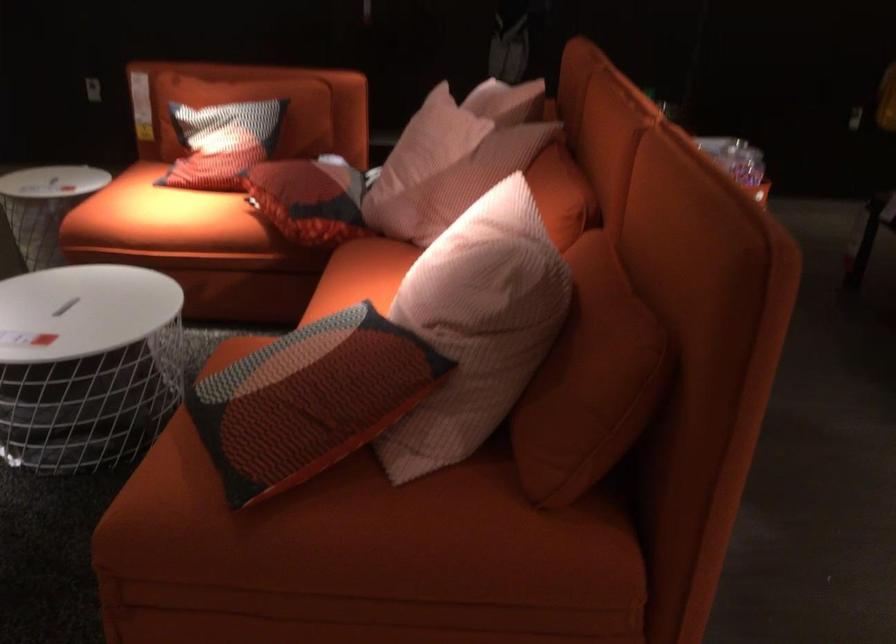
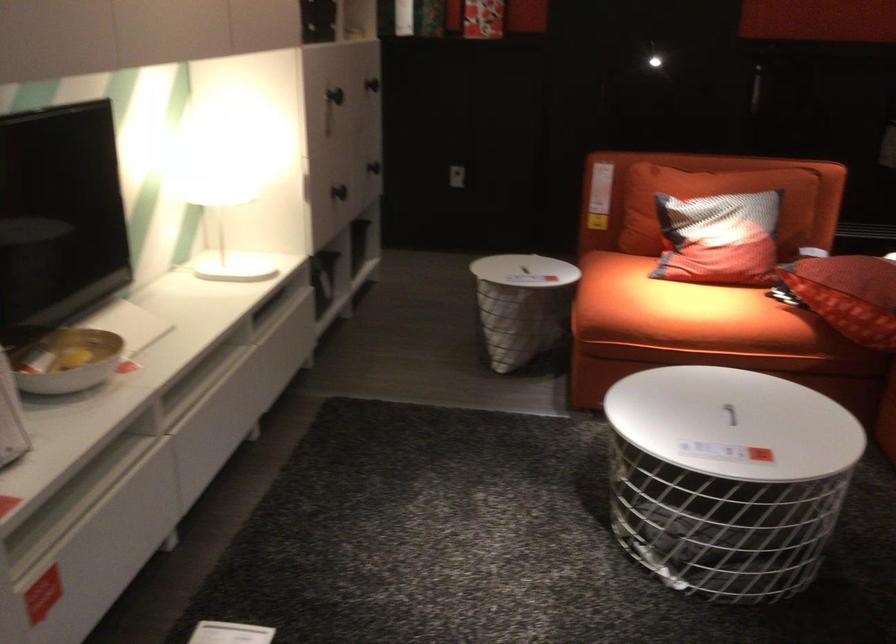
In the second image, find the point that corresponds to the point at 95,301 in the first image.

(729, 413)